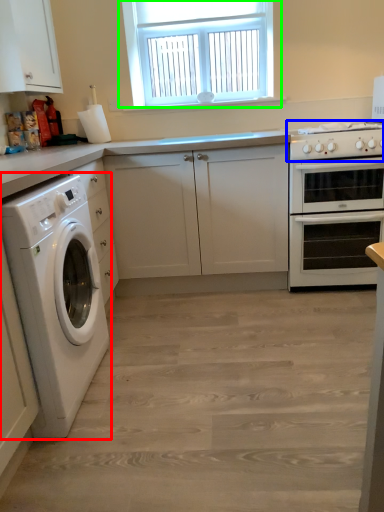
Question: Estimate the real-world distances between objects in this image. Which object is closer to washing machine (highlighted by a red box), gas stove (highlighted by a blue box) or window (highlighted by a green box)?

Choices:
 (A) gas stove
 (B) window

Answer: (A)